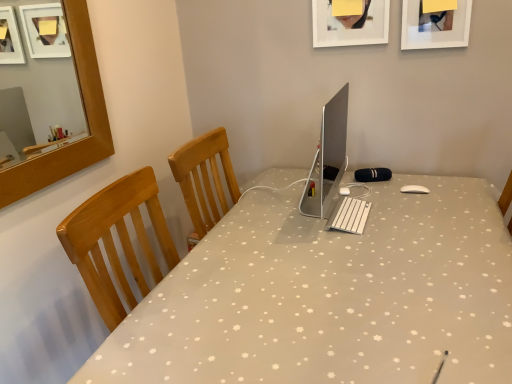
The width and height of the screenshot is (512, 384). Find the location of `vacant space to the right of white plastic keyboard at center`. vacant space to the right of white plastic keyboard at center is located at coordinates (413, 211).